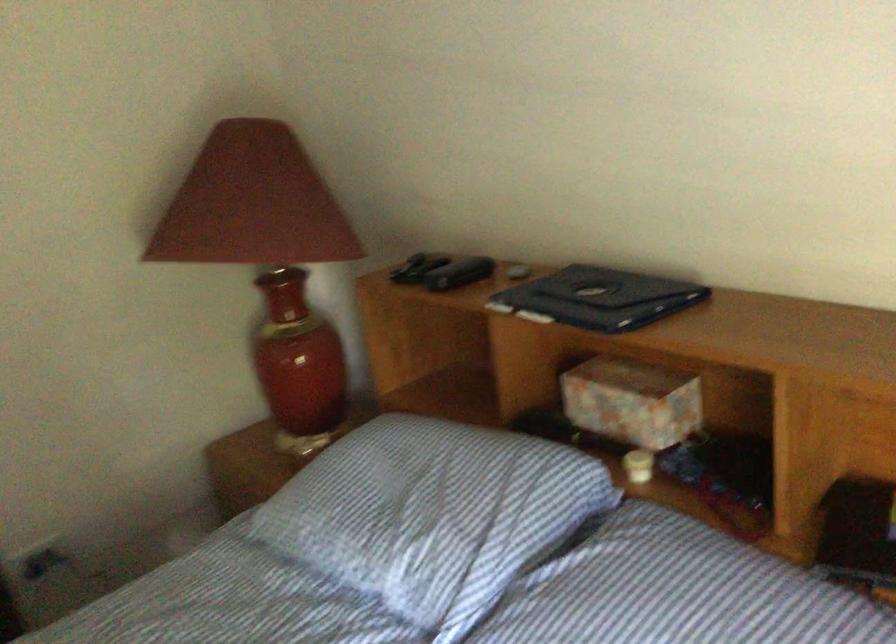
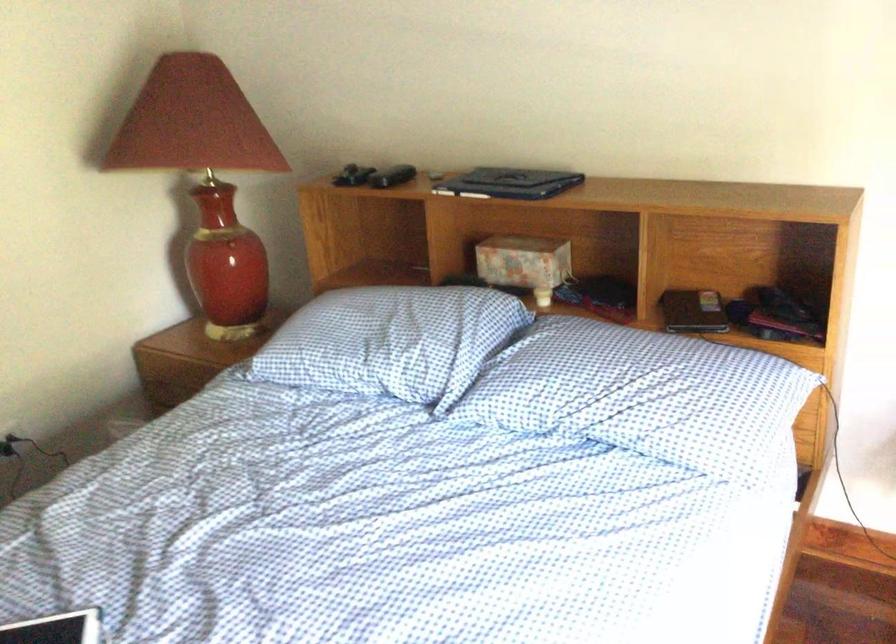
Where in the second image is the point corresponding to the point at 295,348 from the first image?

(229, 249)